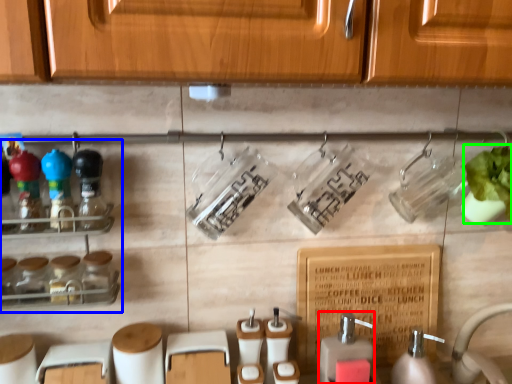
Question: Estimate the real-world distances between objects in this image. Which object is farther from soap dispenser (highlighted by a red box), shelf (highlighted by a blue box) or plant (highlighted by a green box)?

Choices:
 (A) shelf
 (B) plant

Answer: (A)